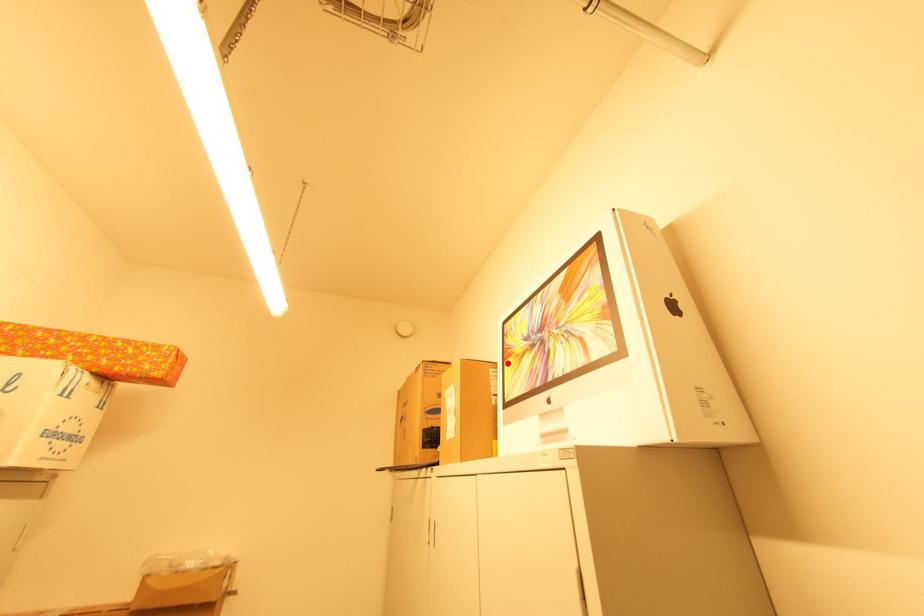
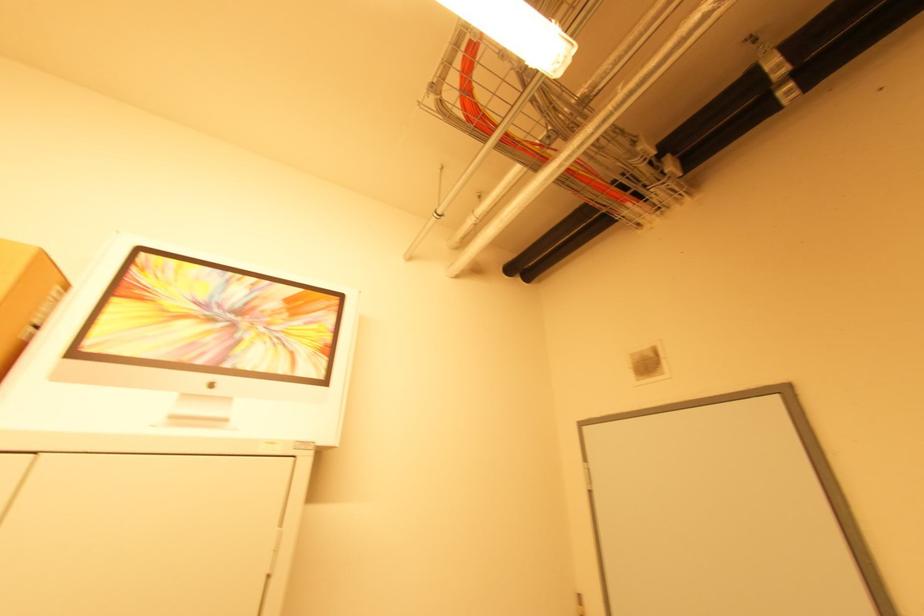
Locate, in the second image, the point that corresponds to the highlighted location in the first image.

(117, 300)